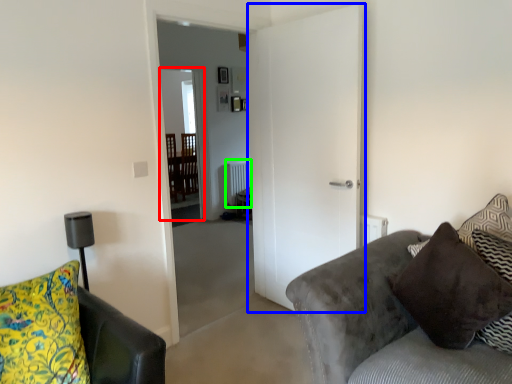
Question: Based on their relative distances, which object is farther from glass door (highlighted by a red box)? Choose from door (highlighted by a blue box) and radiator (highlighted by a green box).

Choices:
 (A) door
 (B) radiator

Answer: (A)